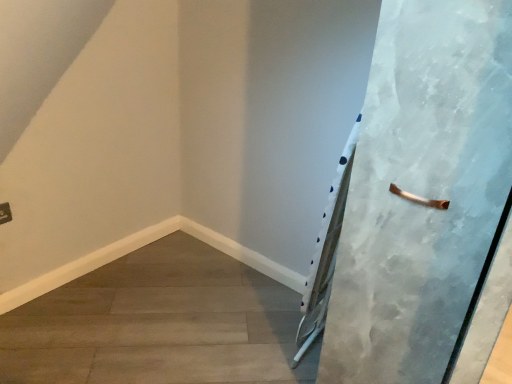
Measure the distance between textured white door at right and camera.

They are 32.84 inches apart.

Identify the location of textured white door at right. This screenshot has width=512, height=384. (426, 201).

Describe the element at coordinates (426, 201) in the screenshot. I see `textured white door at right` at that location.

Describe the element at coordinates (159, 324) in the screenshot. This screenshot has width=512, height=384. I see `smooth concrete floor at lower left` at that location.

The height and width of the screenshot is (384, 512). Find the location of `smooth concrete floor at lower left`. smooth concrete floor at lower left is located at coordinates (159, 324).

At what (x,y) coordinates should I click in order to perform the action: click on textured white door at right. Please return your answer as a coordinate pair (x, y). Looking at the image, I should click on (426, 201).

Considering the relative positions of smooth concrete floor at lower left and textured white door at right in the image provided, is smooth concrete floor at lower left to the right of textured white door at right from the viewer's perspective?

Incorrect, smooth concrete floor at lower left is not on the right side of textured white door at right.

In the scene shown: Is the depth of smooth concrete floor at lower left less than that of textured white door at right?

No, it is behind textured white door at right.

Which is in front, point (103, 360) or point (459, 339)?

The point (459, 339) is more forward.

From the image's perspective, which object appears higher, smooth concrete floor at lower left or textured white door at right?

textured white door at right.

From a real-world perspective, which is physically below, smooth concrete floor at lower left or textured white door at right?

In real-world perspective, smooth concrete floor at lower left is lower.

Considering the sizes of objects smooth concrete floor at lower left and textured white door at right in the image provided, who is thinner, smooth concrete floor at lower left or textured white door at right?

textured white door at right is thinner.

Can you confirm if smooth concrete floor at lower left is taller than textured white door at right?

In fact, smooth concrete floor at lower left may be shorter than textured white door at right.

Who is bigger, smooth concrete floor at lower left or textured white door at right?

textured white door at right is bigger.

Would you say smooth concrete floor at lower left is outside textured white door at right?

smooth concrete floor at lower left lies outside textured white door at right's area.

Are smooth concrete floor at lower left and textured white door at right beside each other?

No, smooth concrete floor at lower left is not touching textured white door at right.

Could you tell me if smooth concrete floor at lower left is facing textured white door at right?

No, smooth concrete floor at lower left is not facing towards textured white door at right.

Image resolution: width=512 pixels, height=384 pixels. I want to click on concrete below the textured white door at right (from the image's perspective), so click(x=159, y=324).

Is textured white door at right at the right side of smooth concrete floor at lower left?

Correct, you'll find textured white door at right to the right of smooth concrete floor at lower left.

Which object is closer to the camera taking this photo, textured white door at right or smooth concrete floor at lower left?

textured white door at right is closer to the camera.

Does point (486, 110) appear closer or farther from the camera than point (202, 373)?

Point (486, 110) appears to be closer to the viewer than point (202, 373).

From the image's perspective, is textured white door at right located above or below smooth concrete floor at lower left?

textured white door at right is situated higher than smooth concrete floor at lower left in the image.

From a real-world perspective, which object stands above the other?

textured white door at right, from a real-world perspective.

From the picture: In terms of width, does textured white door at right look wider or thinner when compared to smooth concrete floor at lower left?

In the image, textured white door at right appears to be more narrow than smooth concrete floor at lower left.

Considering the relative sizes of textured white door at right and smooth concrete floor at lower left in the image provided, is textured white door at right taller than smooth concrete floor at lower left?

Indeed, textured white door at right has a greater height compared to smooth concrete floor at lower left.

Is textured white door at right bigger than smooth concrete floor at lower left?

Yes.

In the scene shown: Is smooth concrete floor at lower left surrounded by textured white door at right?

No, textured white door at right does not contain smooth concrete floor at lower left.

Is there a large distance between textured white door at right and smooth concrete floor at lower left?

No, textured white door at right is not far away from smooth concrete floor at lower left.

Does textured white door at right turn towards smooth concrete floor at lower left?

No, textured white door at right is not aimed at smooth concrete floor at lower left.

What's the angular difference between textured white door at right and smooth concrete floor at lower left's facing directions?

134 degrees.

Locate an element on the screen. concrete that is below the textured white door at right (from the image's perspective) is located at coordinates (159, 324).

Identify the location of concrete on the left of textured white door at right. This screenshot has height=384, width=512. (159, 324).

Where is `door above the smooth concrete floor at lower left (from a real-world perspective)`? The width and height of the screenshot is (512, 384). door above the smooth concrete floor at lower left (from a real-world perspective) is located at coordinates (426, 201).